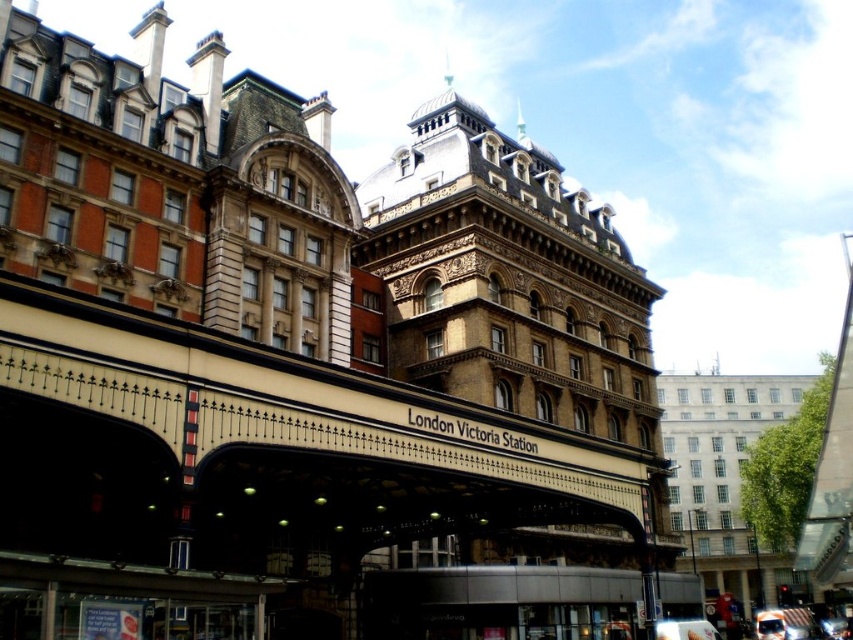
You are standing at the entrance of London Victoria Station and see two points marked on the building. The first point is at coordinate point(296, 416) and the second at point(769, 634). Which point is closer to you?

Point(296, 416) is in front of point(769, 634), so the first point is closer to you.

You are standing at the entrance of London Victoria Station and notice a point marked at coordinates (x=308, y=432). What object is located at this point?

The point at coordinates (x=308, y=432) corresponds to the brown textured awning at center.

You are standing at the entrance of London Victoria Station and want to take a photo of the point at coordinate (318, 474). Your camera has a maximum zoom range of 50 meters. Can you capture the point in focus without moving closer?

The point at coordinate (318, 474) is 46.53 meters away from the camera. Since the camera can zoom up to 50 meters, you can capture the point in focus without moving closer.